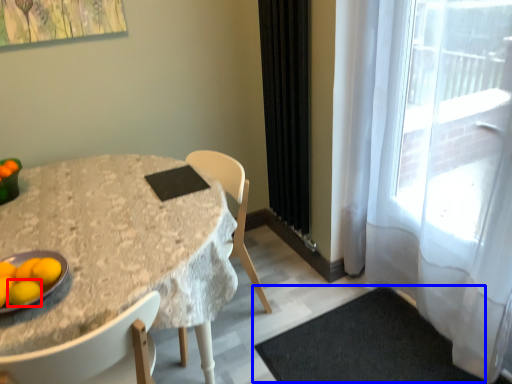
Question: Which of the following is the farthest to the observer, lemon (highlighted by a red box) or doormat (highlighted by a blue box)?

Choices:
 (A) lemon
 (B) doormat

Answer: (B)